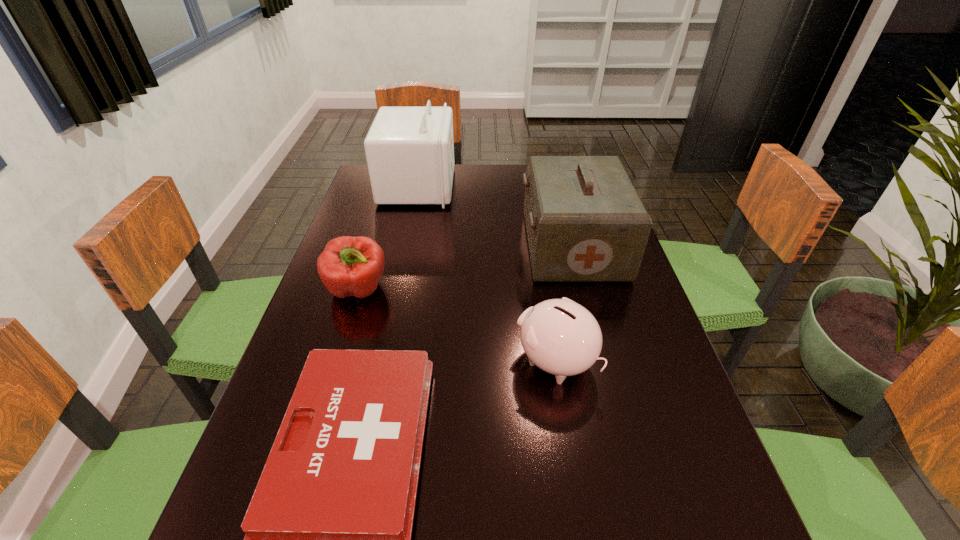
I want to click on the farthest object, so click(410, 150).

Locate an element on the screen. the tallest first-aid kit is located at coordinates (410, 150).

Where is `the fourth shortest object`? This screenshot has width=960, height=540. the fourth shortest object is located at coordinates (585, 221).

Find the location of `the second shortest first-aid kit`. the second shortest first-aid kit is located at coordinates (585, 221).

Image resolution: width=960 pixels, height=540 pixels. I want to click on bell pepper, so click(349, 266).

Locate an element on the screen. The height and width of the screenshot is (540, 960). piggy bank is located at coordinates (561, 337).

Locate an element on the screen. free space located on the front-facing side of the farthest object is located at coordinates (491, 186).

The image size is (960, 540). In order to click on vacant region located on the front of the second tallest object in this screenshot , I will do `click(587, 299)`.

Locate an element on the screen. Image resolution: width=960 pixels, height=540 pixels. vacant area situated 0.330m on the back of the bell pepper is located at coordinates (386, 200).

Find the location of a particular element. The image size is (960, 540). vacant area located on the right of the piggy bank is located at coordinates (635, 361).